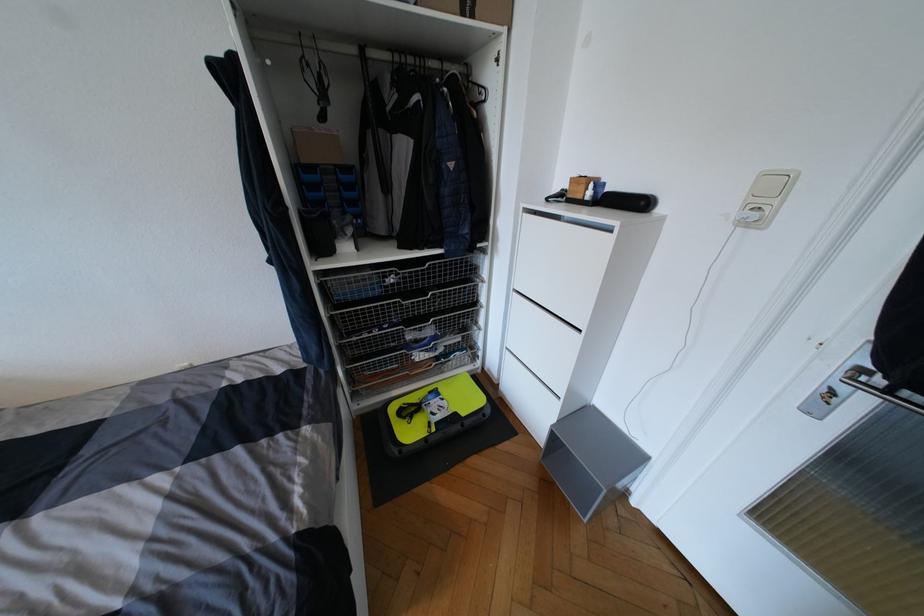
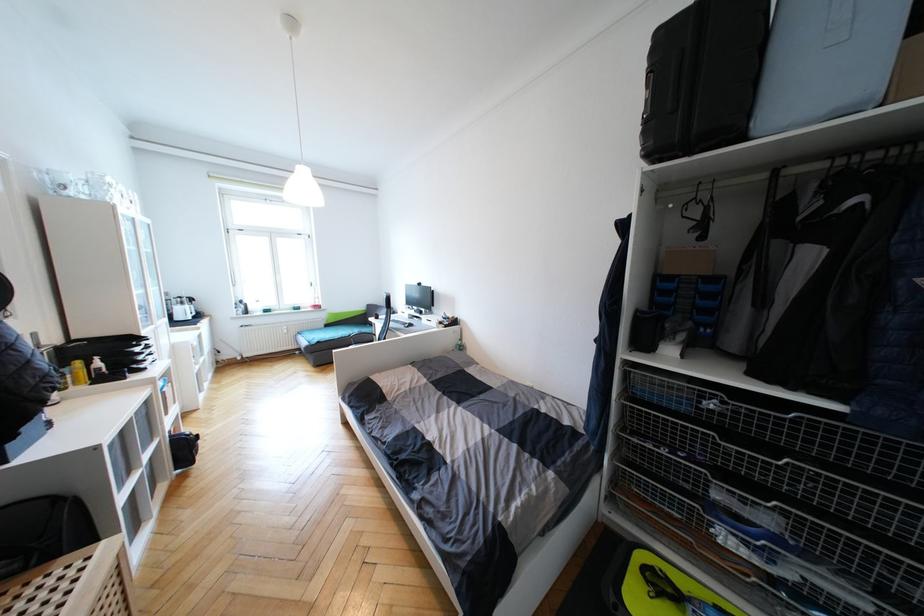
In the second image, find the point that corresponds to point (411, 338) in the first image.

(720, 496)